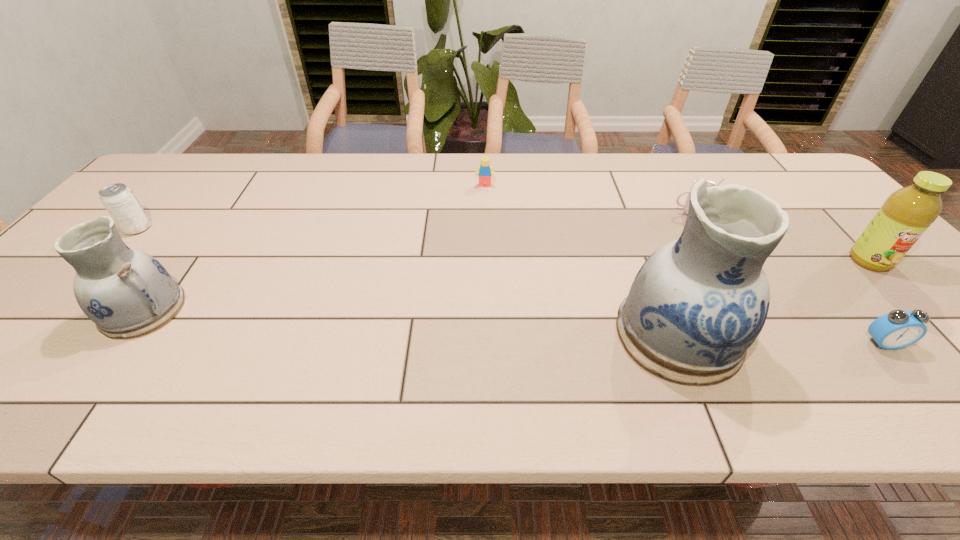
Where is `alarm clock at the near edge`? This screenshot has height=540, width=960. alarm clock at the near edge is located at coordinates (897, 329).

The width and height of the screenshot is (960, 540). In order to click on object present at the left edge in this screenshot , I will do `click(120, 202)`.

Identify the location of fruit juice present at the right edge. (906, 214).

Find the location of a particular element. alarm clock at the right edge is located at coordinates (897, 329).

Locate an element on the screen. The height and width of the screenshot is (540, 960). object situated at the near right corner is located at coordinates (897, 329).

This screenshot has height=540, width=960. I want to click on blank space at the far edge of the desktop, so click(635, 170).

At what (x,y) coordinates should I click in order to perform the action: click on free location at the near edge. Please return your answer as a coordinate pair (x, y). Looking at the image, I should click on 890,353.

This screenshot has height=540, width=960. Find the location of `vacant space at the left edge of the desktop`. vacant space at the left edge of the desktop is located at coordinates point(163,220).

In the image, there is a desktop. In order to click on free region at the far left corner in this screenshot , I will do `click(218, 154)`.

Image resolution: width=960 pixels, height=540 pixels. In the image, there is a desktop. Identify the location of vacant space at the far right corner. (800, 167).